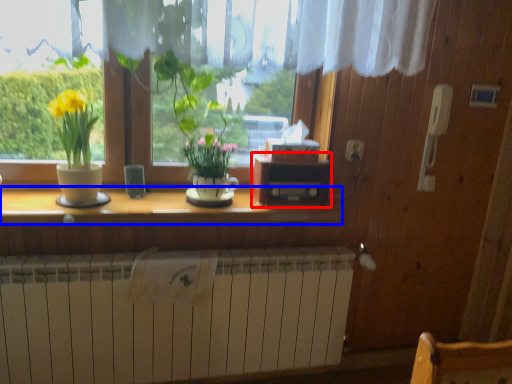
Question: Which point is further to the camera, window box (highlighted by a red box) or counter top (highlighted by a blue box)?

Choices:
 (A) window box
 (B) counter top

Answer: (A)